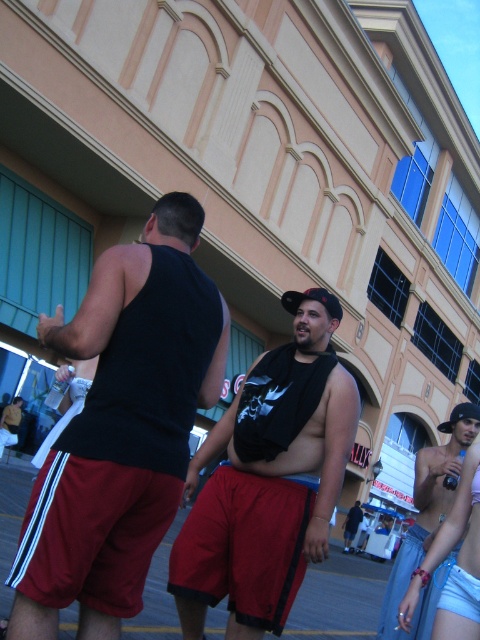
Who is positioned more to the right, black matte tank top at center or matte black tank top at center?

matte black tank top at center is more to the right.

Can you confirm if black matte tank top at center is positioned to the right of matte black tank top at center?

In fact, black matte tank top at center is to the left of matte black tank top at center.

Where is `black matte tank top at center`? black matte tank top at center is located at coordinates (121, 428).

Is black matte tank top at center above nude skin at lower right?

Yes.

Describe the element at coordinates (121, 428) in the screenshot. I see `black matte tank top at center` at that location.

Measure the distance between point [127,394] and camera.

A distance of 3.07 meters exists between point [127,394] and camera.

Find the location of `black matte tank top at center`. black matte tank top at center is located at coordinates (121, 428).

Can you confirm if nude skin at lower right is positioned to the right of matte black tank top at center?

In fact, nude skin at lower right is to the left of matte black tank top at center.

Which is behind, point (435, 550) or point (356, 525)?

The point (356, 525) is behind.

Is point (459, 614) positioned before point (358, 499)?

Yes, it is.

Identify the location of nude skin at lower right. (451, 538).